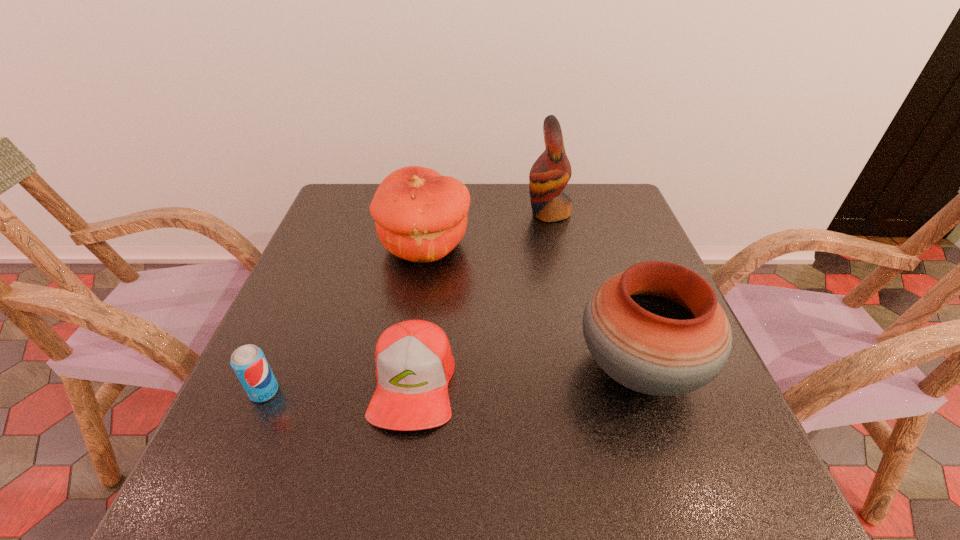
What are the coordinates of `blank region between the pumpkin and the pottery` in the screenshot? It's located at (533, 307).

Locate an element on the screen. The image size is (960, 540). free spot between the baseball cap and the soda can is located at coordinates (339, 387).

The width and height of the screenshot is (960, 540). Find the location of `blank region between the baseball cap and the pottery`. blank region between the baseball cap and the pottery is located at coordinates (526, 375).

Identify which object is the fourth closest to the pottery. Please provide its 2D coordinates. Your answer should be formatted as a tuple, i.e. [(x, y)], where the tuple contains the x and y coordinates of a point satisfying the conditions above.

[(249, 363)]

Identify which object is the nearest to the baseball cap. Please provide its 2D coordinates. Your answer should be formatted as a tuple, i.e. [(x, y)], where the tuple contains the x and y coordinates of a point satisfying the conditions above.

[(249, 363)]

I want to click on free space in the image that satisfies the following two spatial constraints: 1. on the face of the tallest object; 2. on the front-facing side of the baseball cap, so click(x=585, y=383).

Locate an element on the screen. This screenshot has width=960, height=540. free space that satisfies the following two spatial constraints: 1. on the back side of the pottery; 2. on the face of the parrot is located at coordinates (588, 213).

This screenshot has width=960, height=540. Find the location of `vacant space that satisfies the following two spatial constraints: 1. on the back side of the soda can; 2. on the left side of the pottery`. vacant space that satisfies the following two spatial constraints: 1. on the back side of the soda can; 2. on the left side of the pottery is located at coordinates (275, 368).

This screenshot has width=960, height=540. In order to click on vacant space that satisfies the following two spatial constraints: 1. on the face of the tallest object; 2. on the front-facing side of the baseball cap in this screenshot , I will do `click(585, 383)`.

Find the location of a particular element. The height and width of the screenshot is (540, 960). free spot that satisfies the following two spatial constraints: 1. on the face of the tallest object; 2. on the back side of the pottery is located at coordinates (582, 368).